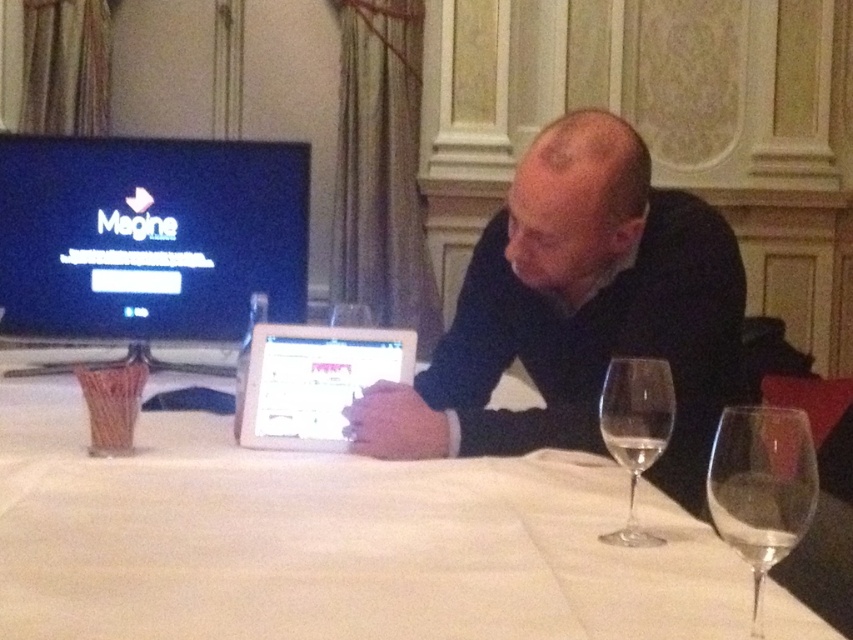
You are a server at a formal event and need to place a dessert plate between the dark blue shirt at center and the white tablecloth in the scene. Is there enough space to place the plate between them?

The objects dark blue shirt at center and white tablecloth in the scene are 1.30 meters apart, so yes, there is enough space to place the dessert plate between them since the distance is sufficient.

You are a server in a formal dining setting and need to place a new plate on the table. The table has a white cloth at center and a clear glass at lower right. Where should you place the plate so it is between these two items?

The white cloth at center is to the left of the clear glass at lower right, so you should place the plate between the white cloth at center and the clear glass at lower right, to the right of the cloth and left of the glass.

You are a photographer setting up for a formal event. You notice the dark blue shirt at center and the clear glass wine glass at center on the table. Which object is located to the left of the other?

The dark blue shirt at center is positioned on the left side of clear glass wine glass at center.